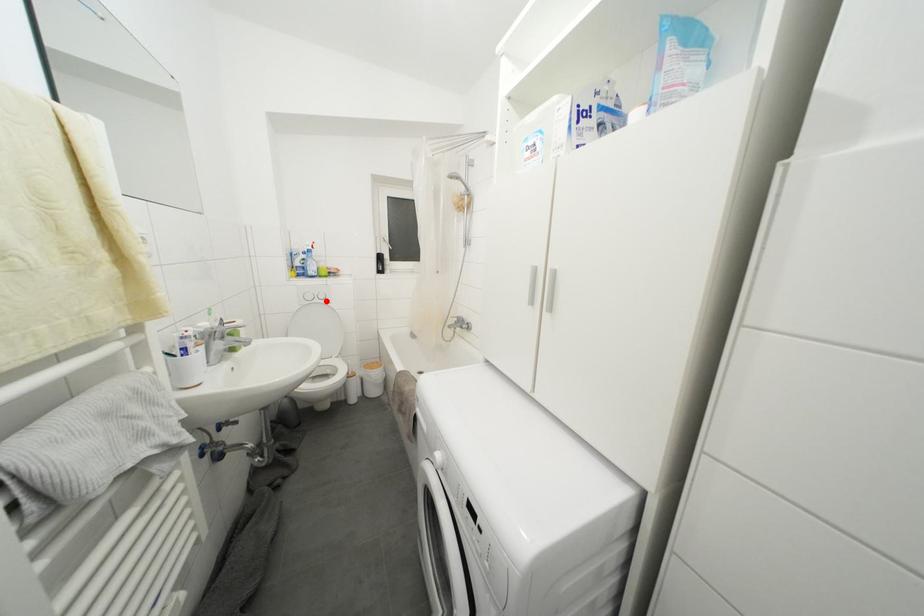
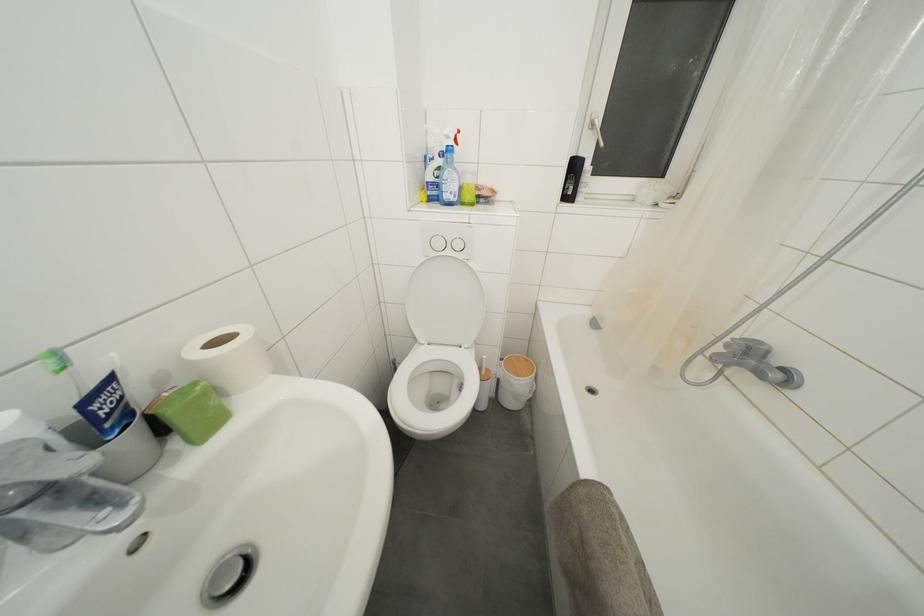
Question: I am providing you with two images of the same scene from different viewpoints. A red point is shown in image1. For the corresponding object point in image2, is it positioned nearer or farther from the camera?

Choices:
 (A) Nearer
 (B) Farther

Answer: (A)